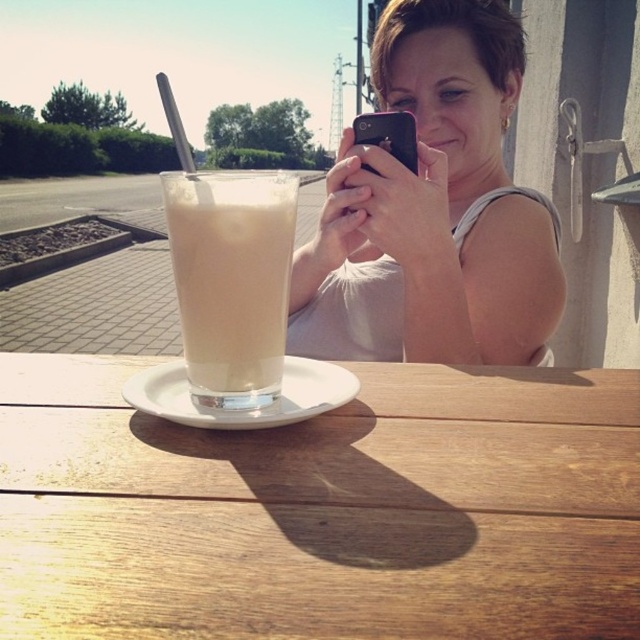
Question: Is wooden table at center wider than black matte smartphone at center?

Choices:
 (A) no
 (B) yes

Answer: (B)

Question: Which of the following is the farthest from the observer?

Choices:
 (A) click(x=266, y=406)
 (B) click(x=480, y=490)
 (C) click(x=516, y=282)
 (D) click(x=252, y=220)

Answer: (C)

Question: Among these points, which one is nearest to the camera?

Choices:
 (A) (376, 134)
 (B) (458, 339)
 (C) (272, 561)

Answer: (C)

Question: Can you confirm if matte white tank top at upper center is wider than white ceramic saucer at center?

Choices:
 (A) no
 (B) yes

Answer: (B)

Question: Is wooden table at center to the right of white ceramic saucer at center from the viewer's perspective?

Choices:
 (A) no
 (B) yes

Answer: (B)

Question: Which point is farther to the camera?

Choices:
 (A) (276, 268)
 (B) (403, 145)
 (C) (332, 401)

Answer: (B)